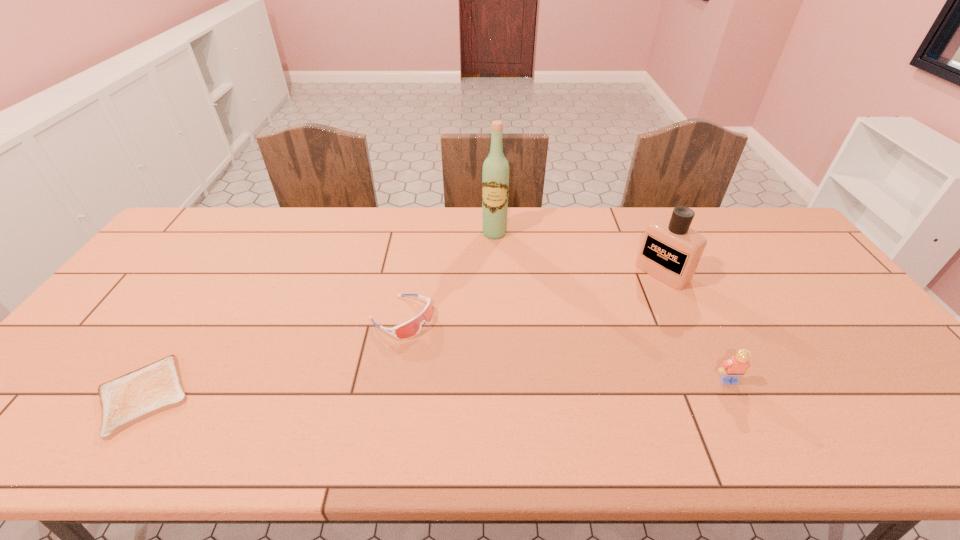
At what (x,y) coordinates should I click in order to perform the action: click on free space on the desktop that is between the toast and the third shortest object and is positioned on the front label of the second tallest object. Please return your answer as a coordinate pair (x, y). Looking at the image, I should click on (517, 386).

Find the location of a particular element. This screenshot has height=540, width=960. vacant spot on the desktop that is between the toast and the third shortest object and is positioned on the front-facing side of the third nearest object is located at coordinates (511, 387).

Where is `free space on the desktop that is between the shortest object and the third shortest object and is positioned on the front-facing side of the wine bottle`? The image size is (960, 540). free space on the desktop that is between the shortest object and the third shortest object and is positioned on the front-facing side of the wine bottle is located at coordinates (457, 388).